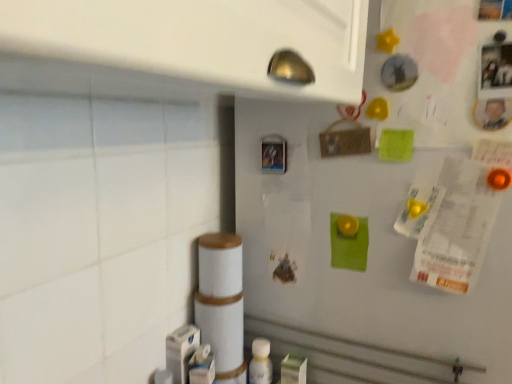
Question: Does white matte refrigerator at upper right appear on the left side of metallic plastic button at center?

Choices:
 (A) yes
 (B) no

Answer: (B)

Question: Is white matte refrigerator at upper right not close to metallic plastic button at center?

Choices:
 (A) yes
 (B) no

Answer: (B)

Question: Is white matte refrigerator at upper right outside metallic plastic button at center?

Choices:
 (A) yes
 (B) no

Answer: (A)

Question: Can you confirm if white matte refrigerator at upper right is thinner than metallic plastic button at center?

Choices:
 (A) no
 (B) yes

Answer: (A)

Question: Can you confirm if white matte refrigerator at upper right is shorter than metallic plastic button at center?

Choices:
 (A) no
 (B) yes

Answer: (A)

Question: From a real-world perspective, does white matte refrigerator at upper right stand above metallic plastic button at center?

Choices:
 (A) no
 (B) yes

Answer: (A)

Question: From a real-world perspective, does metallic plastic button at center sit lower than white plastic bottle at lower center?

Choices:
 (A) yes
 (B) no

Answer: (B)

Question: Does metallic plastic button at center have a lesser height compared to white plastic bottle at lower center?

Choices:
 (A) no
 (B) yes

Answer: (B)

Question: Could white plastic bottle at lower center be considered to be inside metallic plastic button at center?

Choices:
 (A) yes
 (B) no

Answer: (B)

Question: Can you confirm if metallic plastic button at center is thinner than white plastic bottle at lower center?

Choices:
 (A) no
 (B) yes

Answer: (B)

Question: Can you confirm if metallic plastic button at center is taller than white plastic bottle at lower center?

Choices:
 (A) no
 (B) yes

Answer: (A)

Question: Does metallic plastic button at center have a larger size compared to white plastic bottle at lower center?

Choices:
 (A) yes
 (B) no

Answer: (B)

Question: Considering the relative positions of white plastic bottle at lower center and metallic plastic button at center in the image provided, is white plastic bottle at lower center in front of metallic plastic button at center?

Choices:
 (A) no
 (B) yes

Answer: (A)